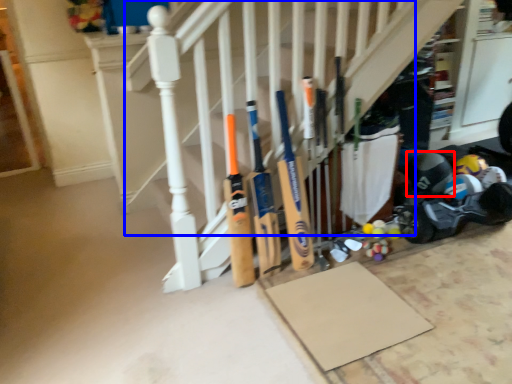
Question: Which point is further to the camera, helmet (highlighted by a red box) or stairs (highlighted by a blue box)?

Choices:
 (A) helmet
 (B) stairs

Answer: (A)